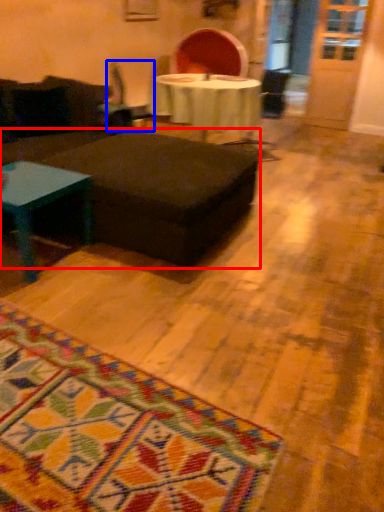
Question: Which object appears farthest to the camera in this image, table (highlighted by a red box) or swivel chair (highlighted by a blue box)?

Choices:
 (A) table
 (B) swivel chair

Answer: (B)